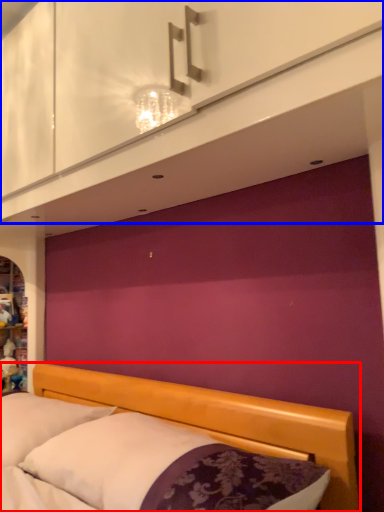
Question: Which object appears farthest to the camera in this image, bed (highlighted by a red box) or dresser (highlighted by a blue box)?

Choices:
 (A) bed
 (B) dresser

Answer: (B)